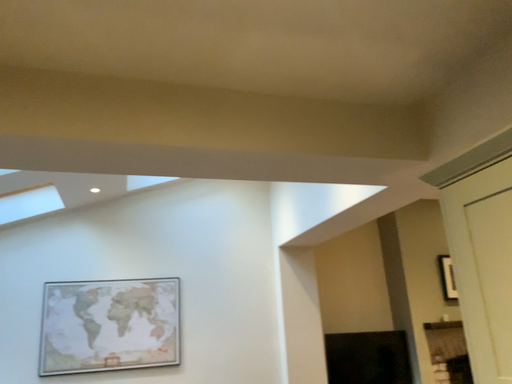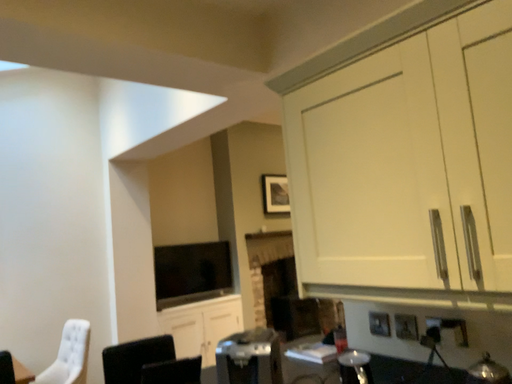
Question: How did the camera likely rotate when shooting the video?

Choices:
 (A) rotated downward
 (B) rotated upward

Answer: (A)